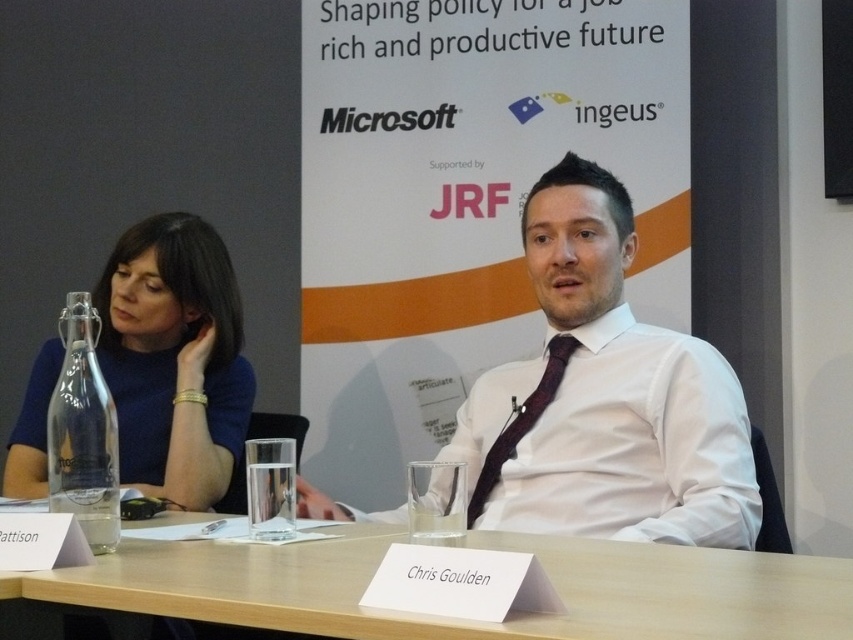
You are organizing a conference and need to place a name tag for the presenter. The name tag must be placed in front of the clear glass bottle at left. Where should you place it in relation to the maroon satin tie at center?

The name tag should be placed in front of the clear glass bottle at left, which is already positioned in front of the maroon satin tie at center. Therefore, the name tag will also be in front of the maroon satin tie at center.

You are a photographer setting up for a panel discussion. You need to place a microphone stand between the light wood table at center and the clear glass bottle at left. Based on their positions, where should you place the microphone stand so it doesn

The light wood table at center is located below the clear glass bottle at left, so the microphone stand should be placed between them horizontally, ensuring it doesn